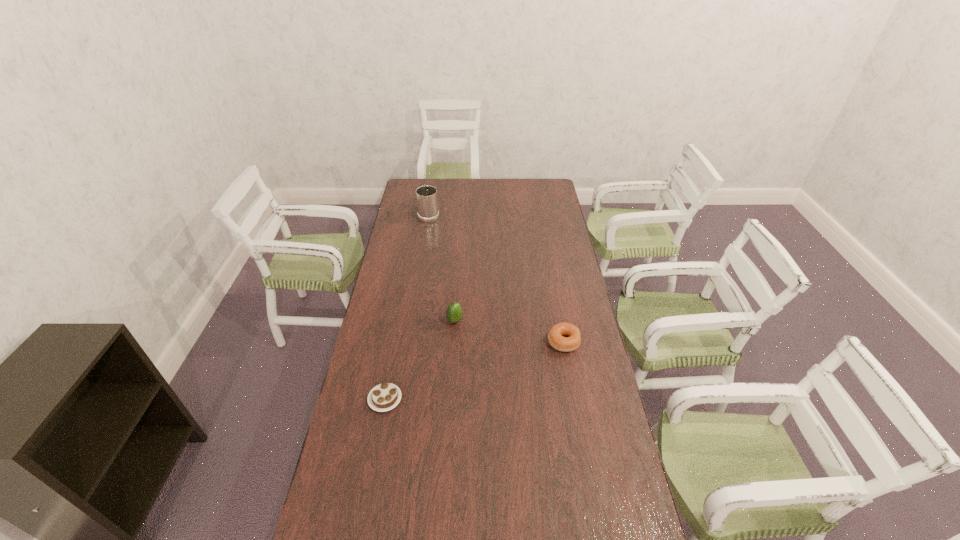
Locate an element on the screen. The height and width of the screenshot is (540, 960). object that is the third closest to the third tallest object is located at coordinates (427, 202).

I want to click on the closest object relative to the chocolate cake, so click(454, 313).